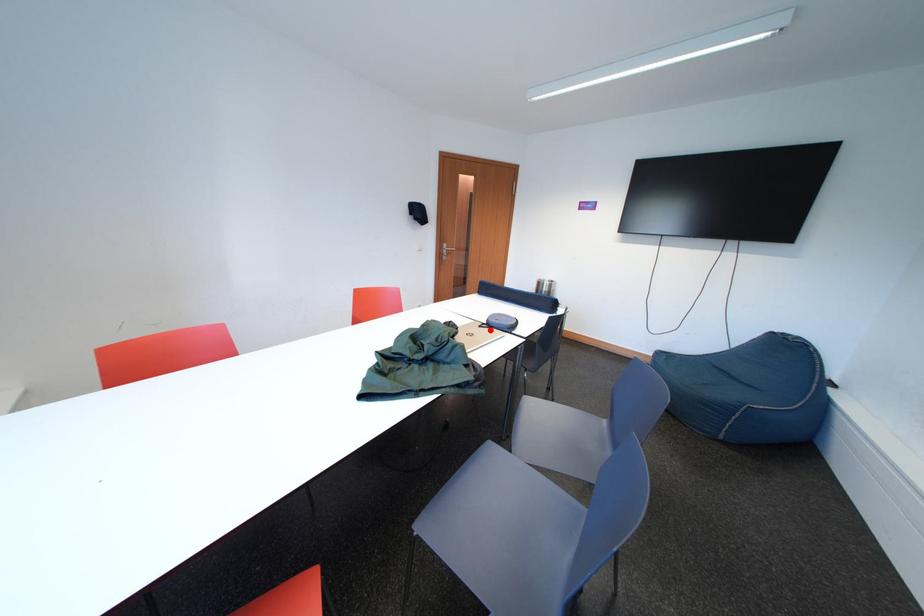
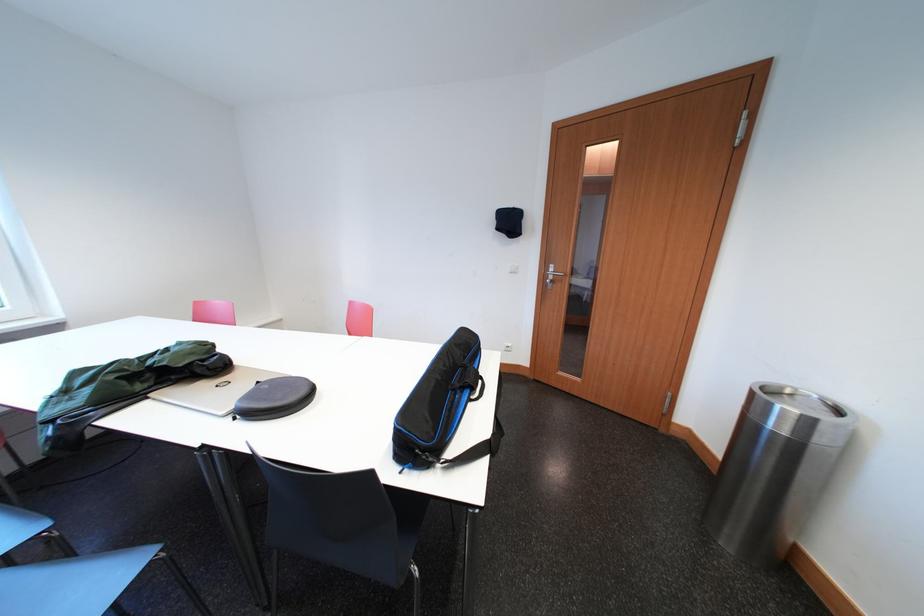
Locate, in the second image, the point that corresponds to the highlighted location in the first image.

(268, 387)